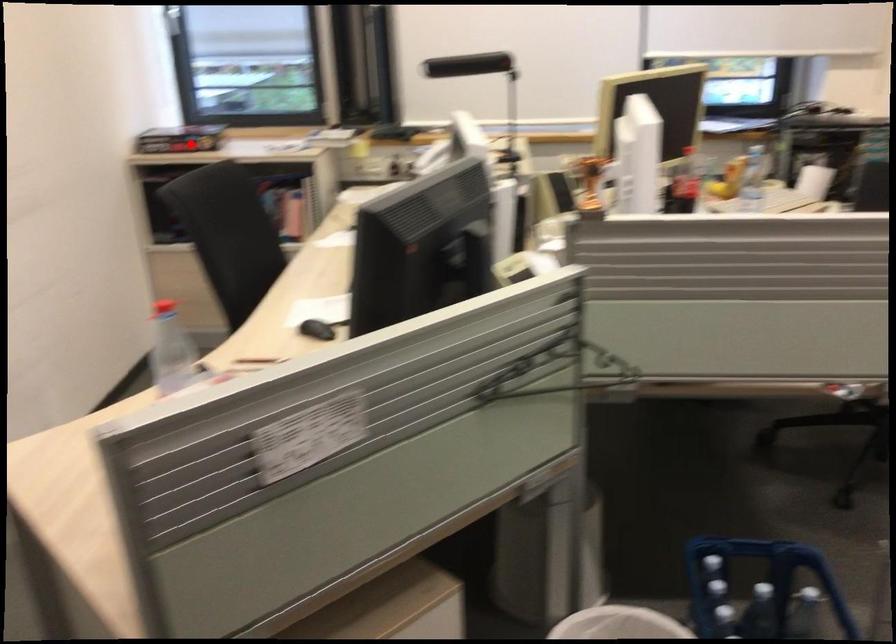
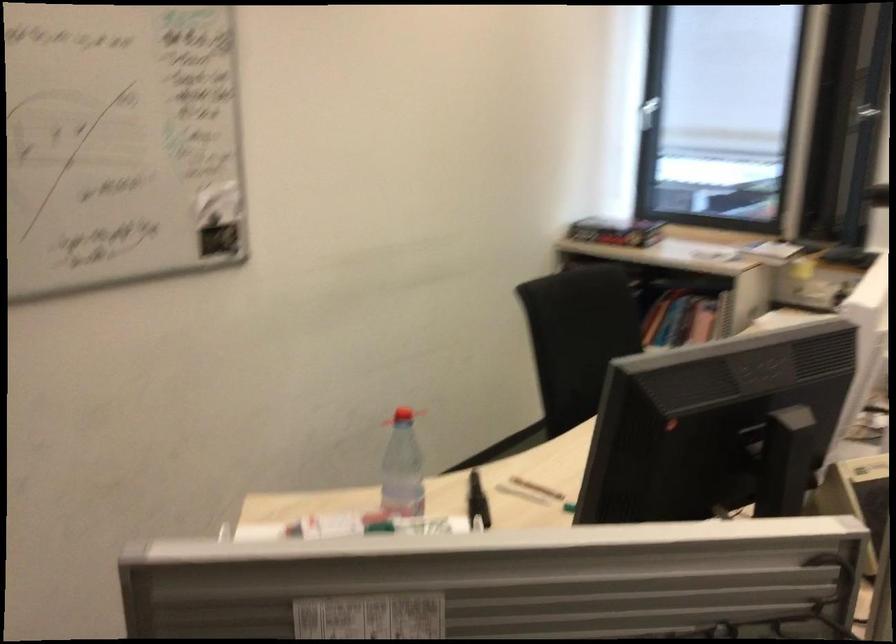
Question: I am providing you with two images of the same scene from different viewpoints. A red point is marked on the first image. Can you still see the location of the red point in image 2?

Choices:
 (A) Yes
 (B) No

Answer: (A)